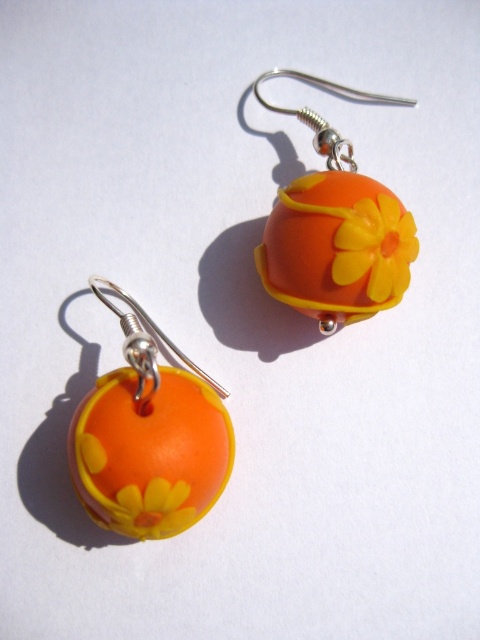
Who is lower down, orange matte/porcelain flower at center or silver/metallic hook at lower left?

silver/metallic hook at lower left is lower down.

Who is more distant from viewer, (x=266, y=280) or (x=205, y=380)?

The point (x=266, y=280) is more distant.

Between point (365, 220) and point (160, 337), which one is positioned behind?

The point (160, 337) is more distant.

The width and height of the screenshot is (480, 640). I want to click on orange matte/porcelain flower at center, so click(x=336, y=228).

Can you confirm if orange matte/porcelain flower at center is smaller than yellow matte flower at center?

No, orange matte/porcelain flower at center is not smaller than yellow matte flower at center.

Is orange matte/porcelain flower at center in front of yellow matte flower at center?

Yes, it is.

Image resolution: width=480 pixels, height=640 pixels. Describe the element at coordinates (336, 228) in the screenshot. I see `orange matte/porcelain flower at center` at that location.

You are a GUI agent. You are given a task and a screenshot of the screen. Output one action in this format:
    pyautogui.click(x=<x>, y=<y>)
    Task: Click on the orange matte/porcelain flower at center
    Image resolution: width=480 pixels, height=640 pixels.
    Given the screenshot: What is the action you would take?
    pyautogui.click(x=336, y=228)

Does matte orange clay flower at lower left have a greater width compared to orange matte/porcelain flower at center?

No, matte orange clay flower at lower left is not wider than orange matte/porcelain flower at center.

The width and height of the screenshot is (480, 640). I want to click on matte orange clay flower at lower left, so click(148, 438).

Locate an element on the screen. This screenshot has height=640, width=480. matte orange clay flower at lower left is located at coordinates (148, 438).